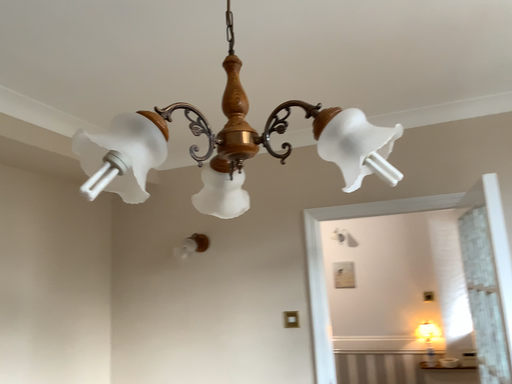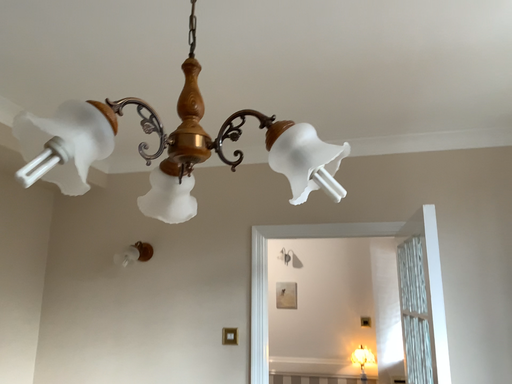
Question: Which way did the camera rotate in the video?

Choices:
 (A) rotated right
 (B) rotated left

Answer: (A)